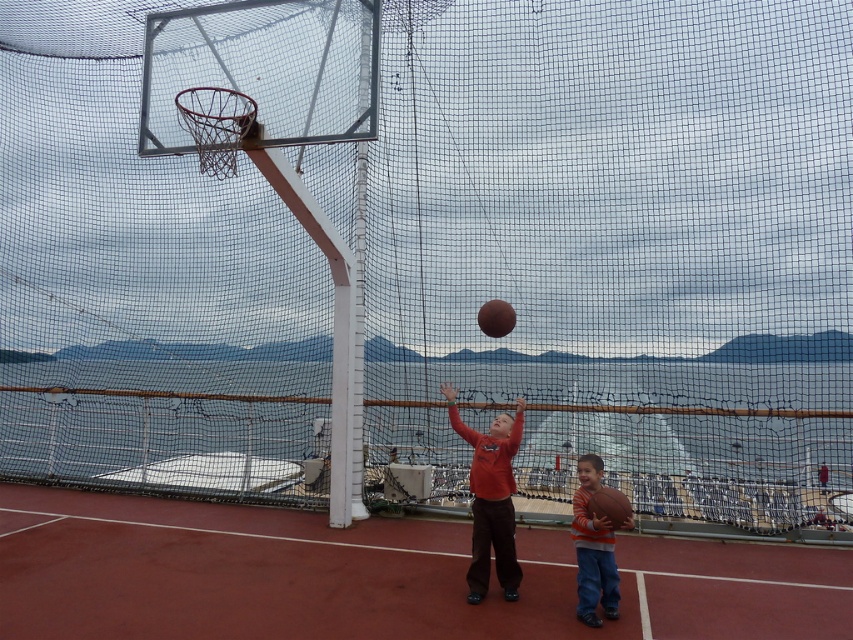
Is point (194, 116) less distant than point (506, 310)?

Yes, point (194, 116) is in front of point (506, 310).

Which of these two, metallic silver basketball hoop at upper center or glossy brown basketball at center, stands shorter?

glossy brown basketball at center

The width and height of the screenshot is (853, 640). What are the coordinates of `metallic silver basketball hoop at upper center` in the screenshot? It's located at (216, 125).

Is metallic silver basketball hoop at upper center taller than rubber textured basketball at lower right?

Yes, metallic silver basketball hoop at upper center is taller than rubber textured basketball at lower right.

Between metallic silver basketball hoop at upper center and rubber textured basketball at lower right, which one has more height?

metallic silver basketball hoop at upper center is taller.

This screenshot has width=853, height=640. In order to click on metallic silver basketball hoop at upper center in this screenshot , I will do `click(216, 125)`.

I want to click on metallic silver basketball hoop at upper center, so click(216, 125).

Can you confirm if rubberized red basketball court at center is positioned above rubber textured basketball at lower right?

No, rubberized red basketball court at center is not above rubber textured basketball at lower right.

How far apart are rubberized red basketball court at center and rubber textured basketball at lower right?

rubberized red basketball court at center is 3.93 meters from rubber textured basketball at lower right.

Is point (41, 621) positioned behind point (589, 497)?

That is False.

The height and width of the screenshot is (640, 853). What are the coordinates of `rubberized red basketball court at center` in the screenshot? It's located at (372, 577).